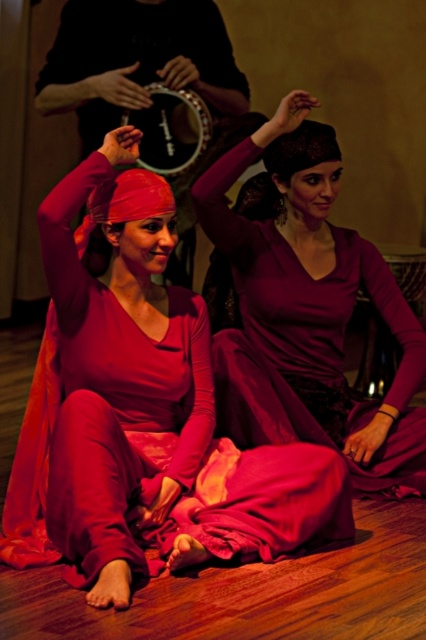
Question: Observing the image, what is the correct spatial positioning of matte pink fabric at center in reference to black leather tambourine at upper center?

Choices:
 (A) right
 (B) left

Answer: (A)

Question: Is matte pink fabric at center positioned in front of black leather tambourine at upper center?

Choices:
 (A) yes
 (B) no

Answer: (A)

Question: Which point is closer to the camera?

Choices:
 (A) (192, 106)
 (B) (62, 442)

Answer: (B)

Question: Which object is positioned farthest from the black leather tambourine at upper center?

Choices:
 (A) matte purple dress at center
 (B) matte pink fabric at center

Answer: (B)

Question: Is matte purple dress at center above black leather tambourine at upper center?

Choices:
 (A) no
 (B) yes

Answer: (A)

Question: Which point is closer to the camera taking this photo?

Choices:
 (A) (63, 218)
 (B) (284, 195)
 (C) (175, 156)

Answer: (A)